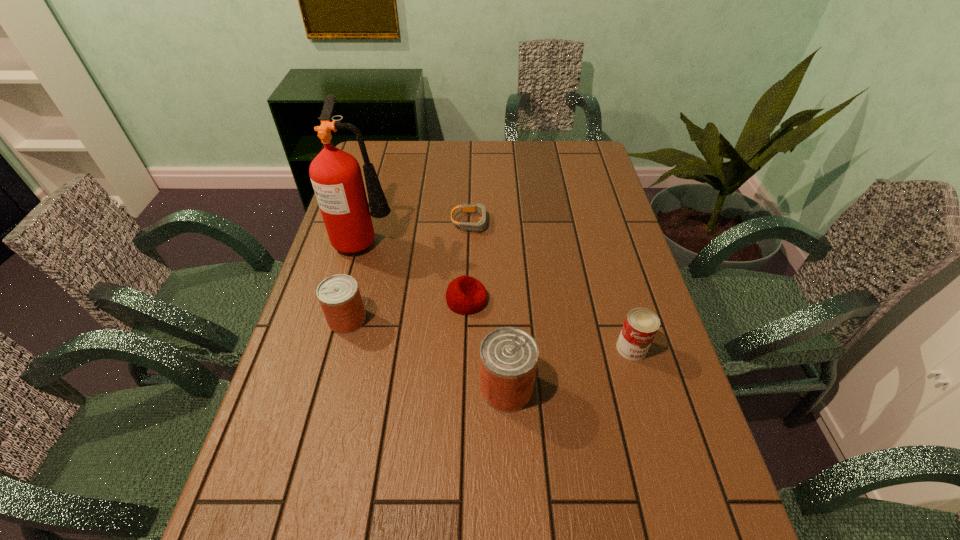
The width and height of the screenshot is (960, 540). I want to click on vacant area at the right edge of the desktop, so click(x=653, y=398).

Where is `blank area at the far right corner`? The height and width of the screenshot is (540, 960). blank area at the far right corner is located at coordinates (591, 166).

Locate an element on the screen. vacant space that is in between the nearest object and the shortest object is located at coordinates (489, 305).

Identify the location of vacant area that lies between the second tallest object and the goggles. (489, 305).

Find the location of `free space that is in between the shortest object and the fifth farthest object`. free space that is in between the shortest object and the fifth farthest object is located at coordinates (552, 285).

The height and width of the screenshot is (540, 960). I want to click on vacant area between the fifth farthest object and the second shortest object, so click(549, 324).

Image resolution: width=960 pixels, height=540 pixels. In order to click on vacant space in between the second farthest can and the goggles in this screenshot , I will do `click(552, 285)`.

This screenshot has height=540, width=960. I want to click on free space between the goggles and the farthest can, so click(409, 271).

At what (x,y) coordinates should I click in order to perform the action: click on vacant space that's between the second nearest object and the goggles. Please return your answer as a coordinate pair (x, y). Looking at the image, I should click on (552, 285).

Locate an element on the screen. blank region between the leftmost can and the fire extinguisher is located at coordinates (356, 279).